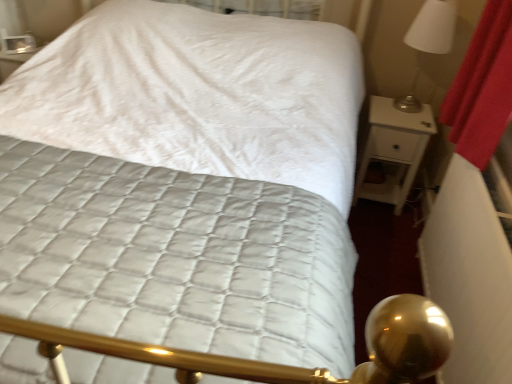
Question: Considering the relative sizes of white glossy nightstand at right and white glossy lampshade at upper right in the image provided, is white glossy nightstand at right taller than white glossy lampshade at upper right?

Choices:
 (A) no
 (B) yes

Answer: (B)

Question: From the image's perspective, is white glossy nightstand at right on top of white glossy lampshade at upper right?

Choices:
 (A) yes
 (B) no

Answer: (B)

Question: From a real-world perspective, is white glossy nightstand at right located higher than white glossy lampshade at upper right?

Choices:
 (A) yes
 (B) no

Answer: (B)

Question: Is white glossy nightstand at right surrounding white glossy lampshade at upper right?

Choices:
 (A) no
 (B) yes

Answer: (A)

Question: Are white glossy nightstand at right and white glossy lampshade at upper right far apart?

Choices:
 (A) no
 (B) yes

Answer: (A)

Question: Is white glossy nightstand at right aimed at white glossy lampshade at upper right?

Choices:
 (A) yes
 (B) no

Answer: (B)

Question: From a real-world perspective, is white glossy lampshade at upper right located higher than white glossy nightstand at right?

Choices:
 (A) yes
 (B) no

Answer: (A)

Question: Is white glossy lampshade at upper right smaller than white glossy nightstand at right?

Choices:
 (A) yes
 (B) no

Answer: (A)

Question: Is white glossy lampshade at upper right next to white glossy nightstand at right?

Choices:
 (A) no
 (B) yes

Answer: (A)

Question: Does white glossy lampshade at upper right have a greater height compared to white glossy nightstand at right?

Choices:
 (A) no
 (B) yes

Answer: (A)

Question: Is the depth of white glossy lampshade at upper right greater than that of white glossy nightstand at right?

Choices:
 (A) no
 (B) yes

Answer: (A)

Question: From the image's perspective, is white glossy lampshade at upper right under white glossy nightstand at right?

Choices:
 (A) yes
 (B) no

Answer: (B)

Question: Considering the relative positions of white glossy lampshade at upper right and white glossy nightstand at right in the image provided, is white glossy lampshade at upper right to the left or to the right of white glossy nightstand at right?

Choices:
 (A) left
 (B) right

Answer: (B)